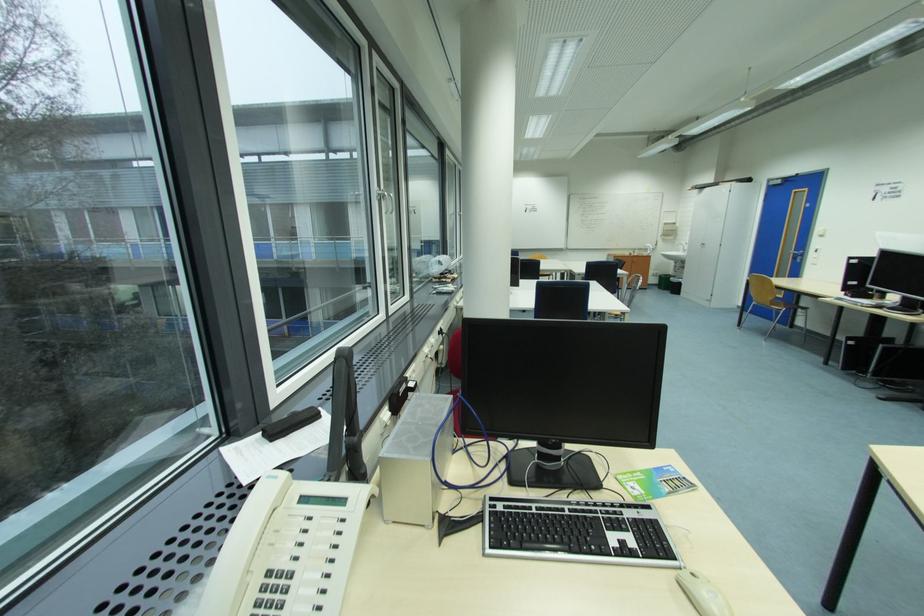
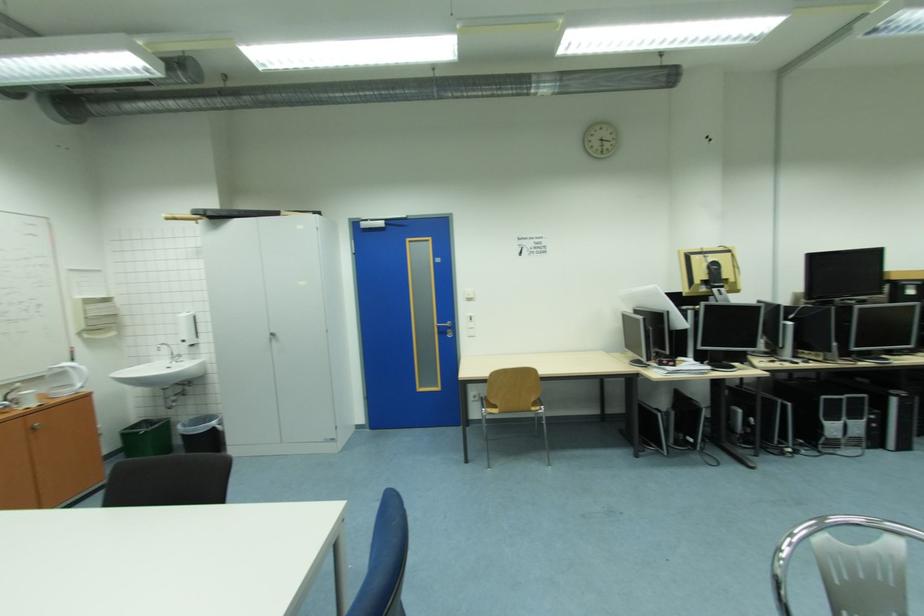
In the second image, find the point that corresponds to [687,281] in the first image.

(220, 424)